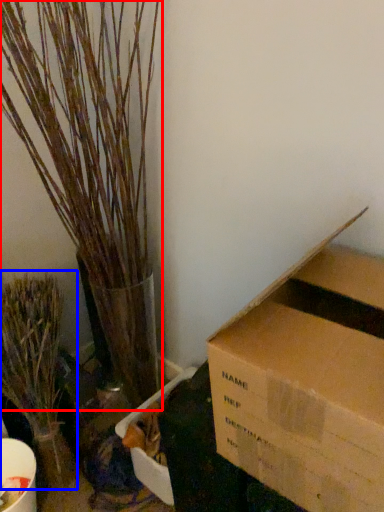
Question: Which object appears closest to the camera in this image, houseplant (highlighted by a red box) or houseplant (highlighted by a blue box)?

Choices:
 (A) houseplant
 (B) houseplant

Answer: (A)